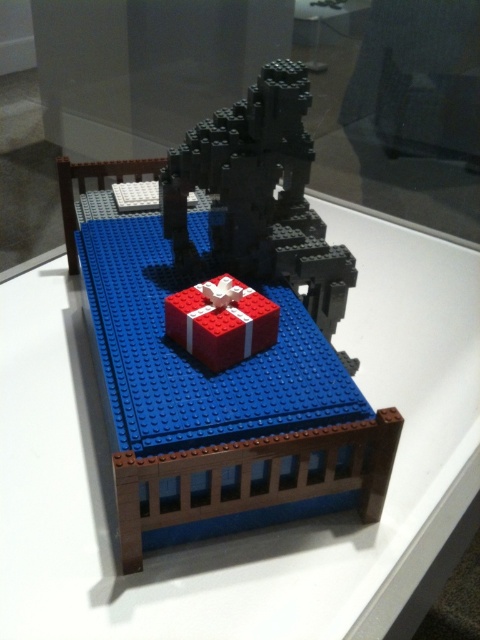
You are a museum security guard checking the LEGO model. You need to locate the transparent glass bed at center. Where exactly is it placed in the image?

The transparent glass bed at center is located at point coordinates of (257, 531).

You are a museum visitor looking at the LEGO model. You see the transparent glass bed at center and the smooth red gift box at center. Which object is positioned to the right of the other?

The transparent glass bed at center is to the right of the smooth red gift box at center according to the description.

You are an artist standing in front of the LEGO model. You notice the transparent glass bed at center and the smooth red gift box at center. Which object is positioned closer to you?

The transparent glass bed at center is closer to the viewer than the smooth red gift box at center.